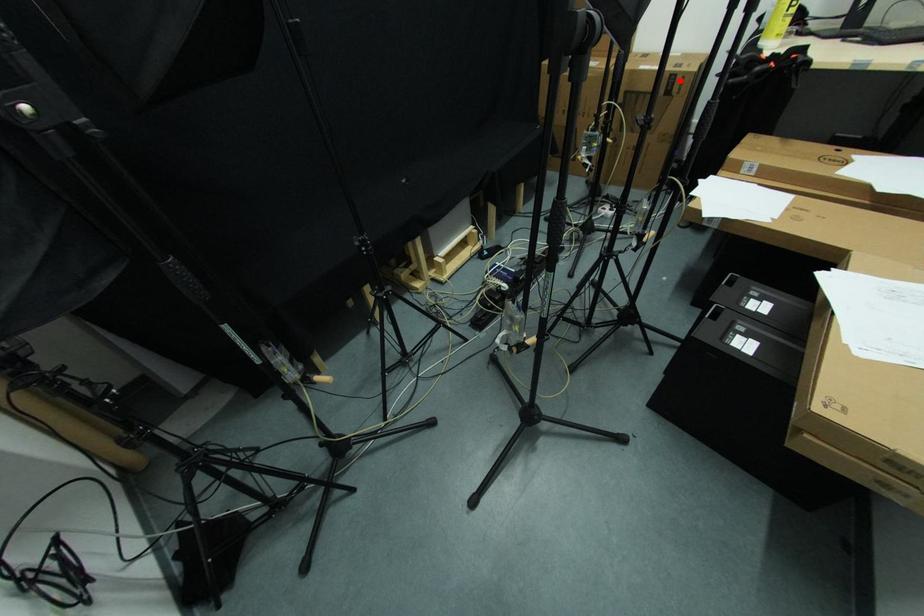
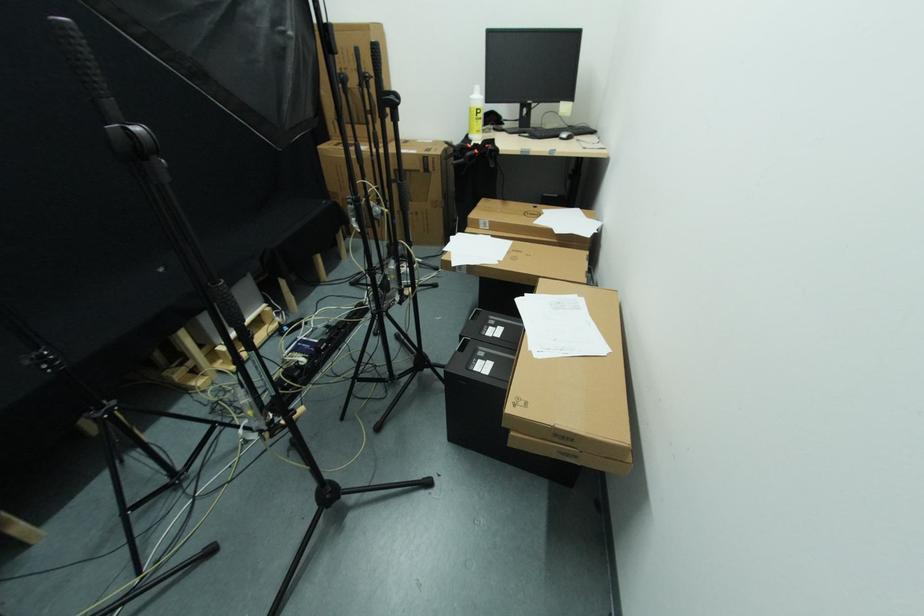
Find the pixel in the second image that matches the highlighted location in the first image.

(432, 161)